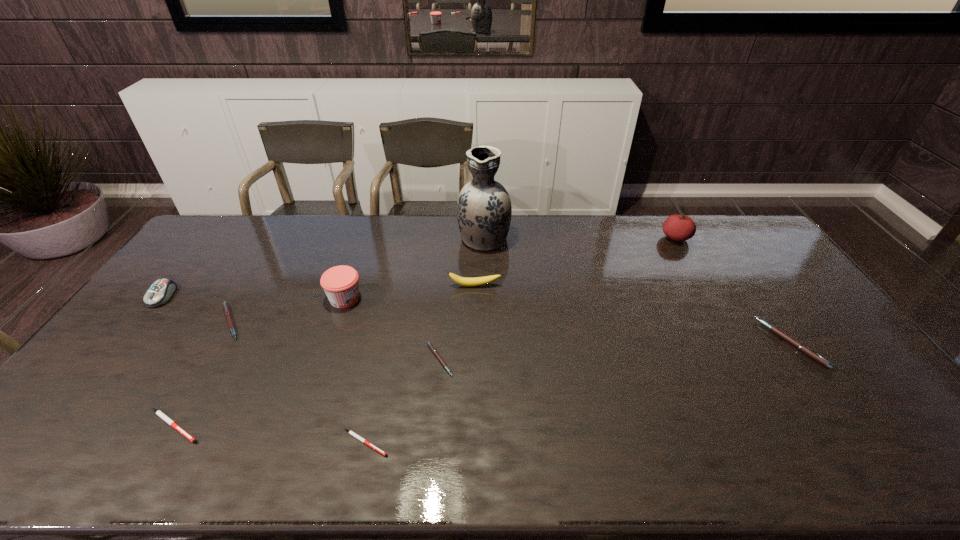
Identify the location of blue vase. (483, 210).

Where is `vase`? The height and width of the screenshot is (540, 960). vase is located at coordinates (483, 210).

At what (x,y) coordinates should I click in order to perform the action: click on tomato. Please return your answer as a coordinate pair (x, y). Looking at the image, I should click on (679, 228).

The width and height of the screenshot is (960, 540). In order to click on the second object from right to left in this screenshot , I will do `click(679, 228)`.

At what (x,y) coordinates should I click in order to perform the action: click on the fourth object from left to right. Please return your answer as a coordinate pair (x, y). The height and width of the screenshot is (540, 960). Looking at the image, I should click on (340, 283).

Where is `the fourth tallest object`? Image resolution: width=960 pixels, height=540 pixels. the fourth tallest object is located at coordinates (477, 281).

Locate an element on the screen. yellow banana is located at coordinates (477, 281).

At what (x,y) coordinates should I click in order to perform the action: click on the fifth tallest object. Please return your answer as a coordinate pair (x, y). The height and width of the screenshot is (540, 960). Looking at the image, I should click on (160, 292).

In order to click on the leftmost object in this screenshot , I will do `click(160, 292)`.

What are the coordinates of `the rightmost pen` in the screenshot? It's located at (797, 344).